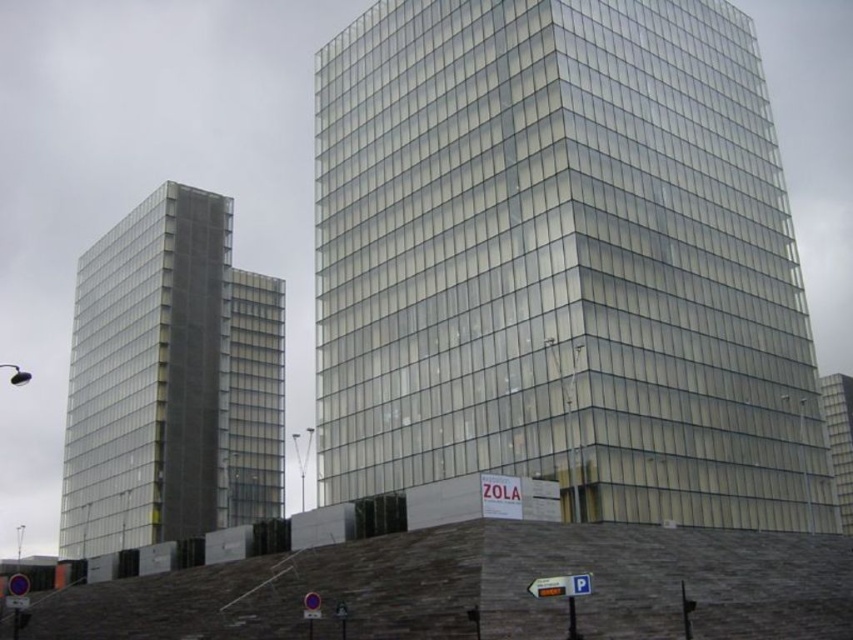
Question: Estimate the real-world distances between objects in this image. Which object is closer to the transparent glass building at center?

Choices:
 (A) transparent glass building at right
 (B) transparent glass tower at left

Answer: (A)

Question: Which of the following is the closest to the observer?

Choices:
 (A) transparent glass tower at left
 (B) transparent glass building at center

Answer: (B)

Question: Is transparent glass building at center wider than transparent glass building at right?

Choices:
 (A) no
 (B) yes

Answer: (A)

Question: Can you confirm if transparent glass building at center is positioned to the right of transparent glass building at right?

Choices:
 (A) yes
 (B) no

Answer: (B)

Question: Which point is farther to the camera?

Choices:
 (A) (822, 385)
 (B) (540, 65)

Answer: (A)

Question: Does transparent glass tower at left come behind transparent glass building at right?

Choices:
 (A) yes
 (B) no

Answer: (A)